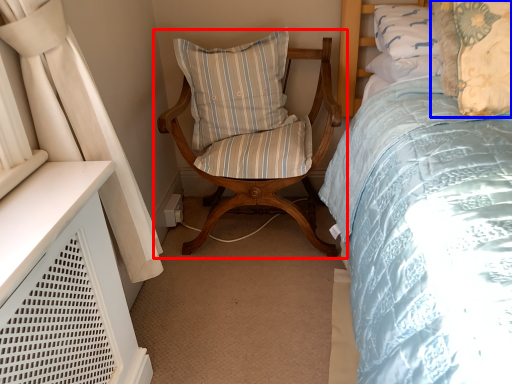
Question: Which object appears farthest to the camera in this image, chair (highlighted by a red box) or pillow (highlighted by a blue box)?

Choices:
 (A) chair
 (B) pillow

Answer: (A)